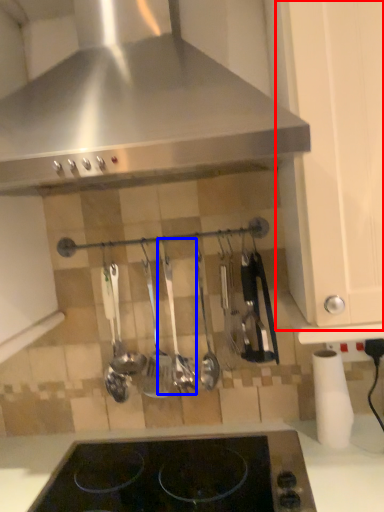
Question: Among these objects, which one is nearest to the camera, cabinetry (highlighted by a red box) or silverware (highlighted by a blue box)?

Choices:
 (A) cabinetry
 (B) silverware

Answer: (A)